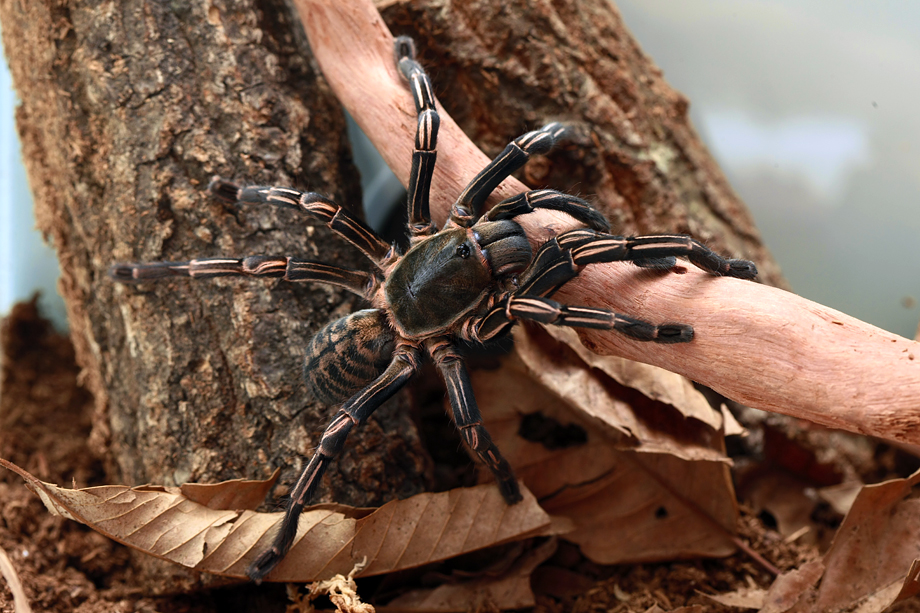
The image size is (920, 613). Identify the location of gray background color. (805, 25).